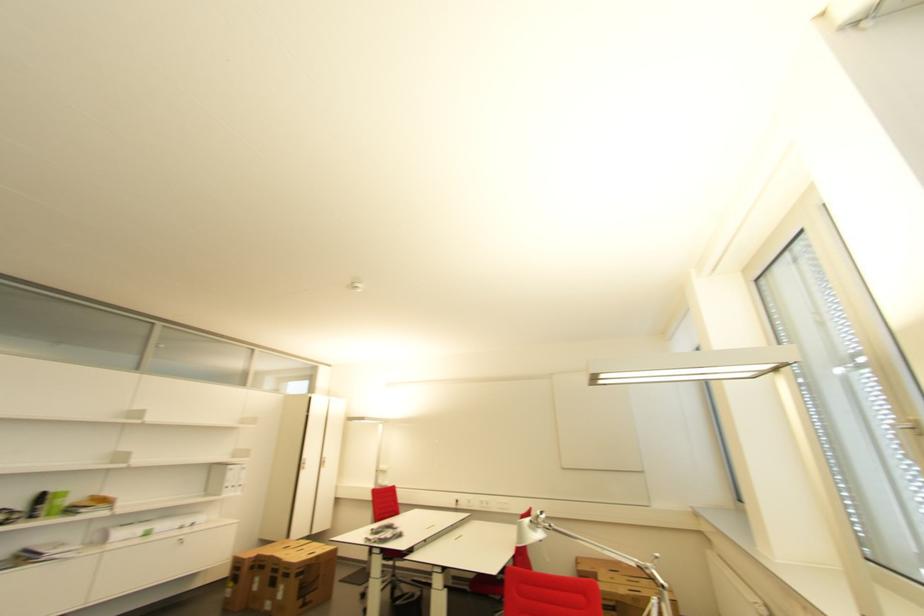
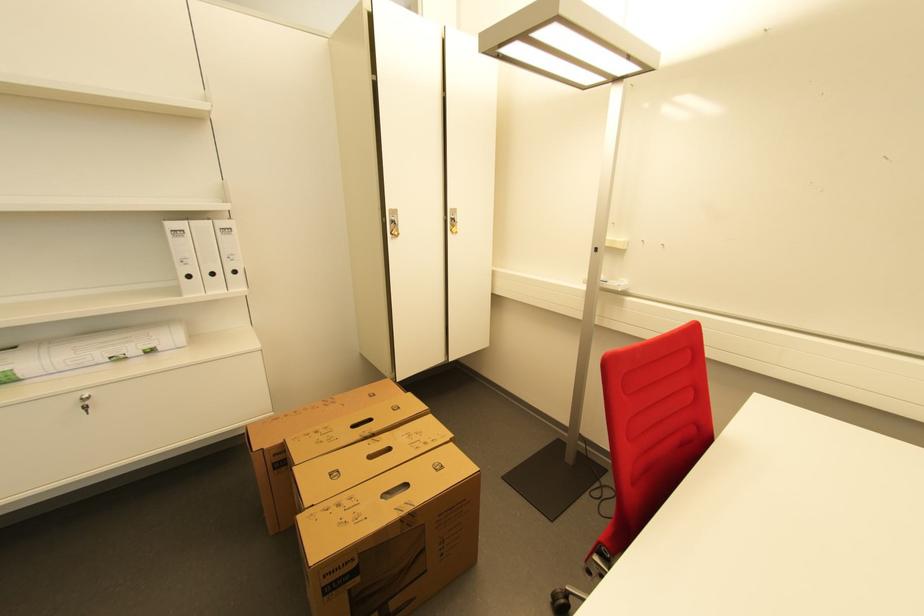
The point at (246, 487) is marked in the first image. Where is the corresponding point in the second image?

(239, 273)